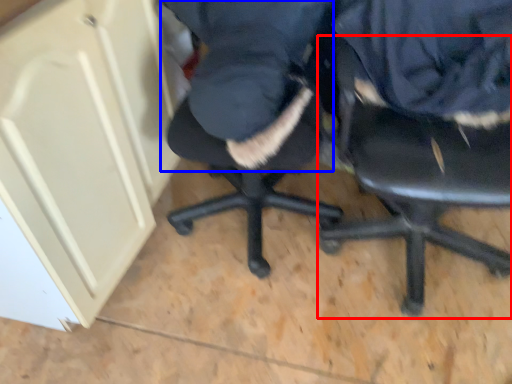
Question: Which of the following is the farthest to the observer, chair (highlighted by a red box) or clothing (highlighted by a blue box)?

Choices:
 (A) chair
 (B) clothing

Answer: (B)